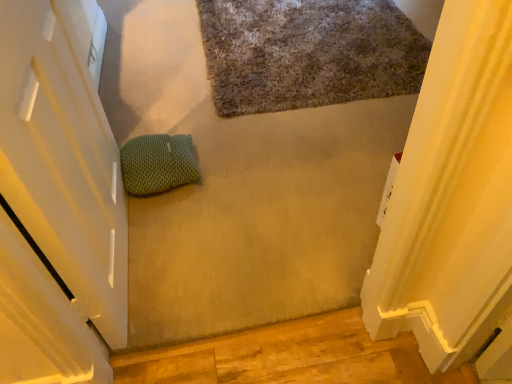
Image resolution: width=512 pixels, height=384 pixels. I want to click on blank area beneath textured gray bath mat at upper center (from a real-world perspective), so click(x=297, y=36).